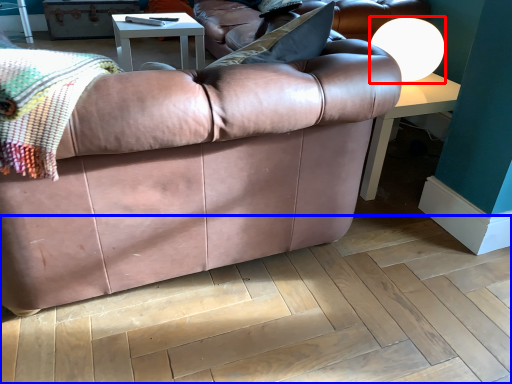
Question: Among these objects, which one is farthest to the camera, lamp (highlighted by a red box) or plywood (highlighted by a blue box)?

Choices:
 (A) lamp
 (B) plywood

Answer: (A)